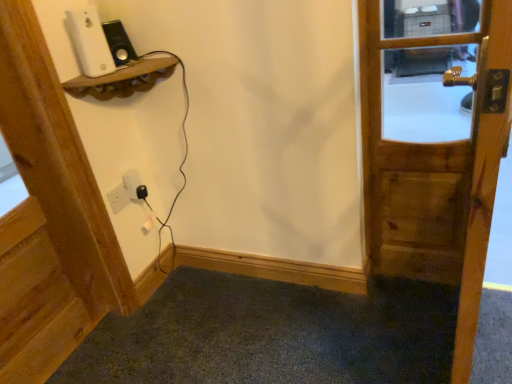
This screenshot has height=384, width=512. What are the coordinates of `white matte ipod at upper left` in the screenshot? It's located at (89, 42).

From the image's perspective, does wooden door at upper left, arranged as the 2th door when viewed from the right, appear higher than white matte ipod at upper left?

No, from the image's perspective, wooden door at upper left, arranged as the 2th door when viewed from the right, is not over white matte ipod at upper left.

Considering the relative positions of wooden door at upper left, which ranks as the first door in left-to-right order, and white matte ipod at upper left in the image provided, is wooden door at upper left, which ranks as the first door in left-to-right order, to the left of white matte ipod at upper left from the viewer's perspective?

Yes.

From a real-world perspective, which object stands above the other?

white matte ipod at upper left, from a real-world perspective.

Is wooden door at upper left, which ranks as the first door in left-to-right order, in contact with white matte ipod at upper left?

wooden door at upper left, which ranks as the first door in left-to-right order, and white matte ipod at upper left are not in contact.

Considering the sizes of objects black plastic plug at lower center and wooden door at upper left, which ranks as the first door in left-to-right order, in the image provided, who is smaller, black plastic plug at lower center or wooden door at upper left, which ranks as the first door in left-to-right order,?

With smaller size is black plastic plug at lower center.

Is black plastic plug at lower center at the left side of wooden door at upper left, arranged as the 2th door when viewed from the right?

In fact, black plastic plug at lower center is to the right of wooden door at upper left, arranged as the 2th door when viewed from the right.

Looking at this image, is black plastic plug at lower center beside wooden door at upper left, which ranks as the first door in left-to-right order?

There is a gap between black plastic plug at lower center and wooden door at upper left, which ranks as the first door in left-to-right order.

Is point (146, 191) closer to viewer compared to point (64, 137)?

No.

Which object is thinner, white matte ipod at upper left or black plastic plug at lower center?

With smaller width is black plastic plug at lower center.

From the image's perspective, is white matte ipod at upper left positioned above or below black plastic plug at lower center?

Based on their image positions, white matte ipod at upper left is located above black plastic plug at lower center.

In terms of size, does white matte ipod at upper left appear bigger or smaller than black plastic plug at lower center?

Considering their sizes, white matte ipod at upper left takes up more space than black plastic plug at lower center.

Locate an element on the screen. The image size is (512, 384). plug behind the white matte ipod at upper left is located at coordinates (141, 192).

From a real-world perspective, is white matte ipod at upper left over wooden door at upper left, arranged as the 2th door when viewed from the right?

Yes, from a real-world perspective, white matte ipod at upper left is above wooden door at upper left, arranged as the 2th door when viewed from the right.

Considering the sizes of white matte ipod at upper left and wooden door at upper left, which ranks as the first door in left-to-right order, in the image, is white matte ipod at upper left wider or thinner than wooden door at upper left, which ranks as the first door in left-to-right order,?

Clearly, white matte ipod at upper left has less width compared to wooden door at upper left, which ranks as the first door in left-to-right order.

Which is more to the right, white matte ipod at upper left or wooden door at upper left, arranged as the 2th door when viewed from the right?

Positioned to the right is white matte ipod at upper left.

From a real-world perspective, is wooden door at upper left, arranged as the 2th door when viewed from the right, positioned over wooden door handle at right, acting as the second door starting from the left, based on gravity?

Indeed, from a real-world perspective, wooden door at upper left, arranged as the 2th door when viewed from the right, stands above wooden door handle at right, acting as the second door starting from the left.

How distant is wooden door at upper left, arranged as the 2th door when viewed from the right, from wooden door handle at right, which is the 1th door in right-to-left order?

wooden door at upper left, arranged as the 2th door when viewed from the right, is 3.53 feet from wooden door handle at right, which is the 1th door in right-to-left order.

How many degrees apart are the facing directions of wooden door at upper left, which ranks as the first door in left-to-right order, and wooden door handle at right, which is the 1th door in right-to-left order?

7.52 degrees separate the facing orientations of wooden door at upper left, which ranks as the first door in left-to-right order, and wooden door handle at right, which is the 1th door in right-to-left order.

Is point (10, 341) positioned in front of point (361, 85)?

No, (10, 341) is further to viewer.

Would you say white matte ipod at upper left is part of black plastic plug at lower center's contents?

No, black plastic plug at lower center does not contain white matte ipod at upper left.

Locate an element on the screen. The width and height of the screenshot is (512, 384). plug below the white matte ipod at upper left (from a real-world perspective) is located at coordinates (141, 192).

From the image's perspective, which is above, black plastic plug at lower center or white matte ipod at upper left?

white matte ipod at upper left is shown above in the image.

From a real-world perspective, who is located lower, black plastic plug at lower center or white matte ipod at upper left?

black plastic plug at lower center, from a real-world perspective.

Which object is further away from the camera taking this photo, wooden door handle at right, which is the 1th door in right-to-left order, or white matte ipod at upper left?

white matte ipod at upper left is further away from the camera.

From a real-world perspective, is wooden door handle at right, which is the 1th door in right-to-left order, physically located above or below white matte ipod at upper left?

From a real-world perspective, wooden door handle at right, which is the 1th door in right-to-left order, is physically below white matte ipod at upper left.

What's the angular difference between wooden door handle at right, acting as the second door starting from the left, and white matte ipod at upper left's facing directions?

9.15 degrees.

You are a GUI agent. You are given a task and a screenshot of the screen. Output one action in this format:
    pyautogui.click(x=<x>, y=<y>)
    Task: Click on the 2nd door below the white matte ipod at upper left (from the image's perspective)
    The width and height of the screenshot is (512, 384).
    Given the screenshot: What is the action you would take?
    pyautogui.click(x=49, y=216)

Find the location of `plug below the wooden door at upper left, arranged as the 2th door when viewed from the right (from a real-world perspective)`. plug below the wooden door at upper left, arranged as the 2th door when viewed from the right (from a real-world perspective) is located at coordinates (141, 192).

Consider the image. Which object lies further to the anchor point wooden door at upper left, arranged as the 2th door when viewed from the right, wooden door handle at right, which is the 1th door in right-to-left order, or white matte ipod at upper left?

Among the two, wooden door handle at right, which is the 1th door in right-to-left order, is located further to wooden door at upper left, arranged as the 2th door when viewed from the right.

Looking at the image, which one is located further to white matte ipod at upper left, wooden door at upper left, which ranks as the first door in left-to-right order, or black plastic plug at lower center?

Among the two, black plastic plug at lower center is located further to white matte ipod at upper left.

Considering their positions, is wooden door handle at right, acting as the second door starting from the left, positioned closer to wooden door at upper left, arranged as the 2th door when viewed from the right, than black plastic plug at lower center?

Based on the image, black plastic plug at lower center appears to be nearer to wooden door at upper left, arranged as the 2th door when viewed from the right.

Looking at the image, which one is located closer to white matte ipod at upper left, wooden door handle at right, which is the 1th door in right-to-left order, or wooden door at upper left, arranged as the 2th door when viewed from the right?

wooden door at upper left, arranged as the 2th door when viewed from the right.

Looking at the image, which one is located further to black plastic plug at lower center, wooden door at upper left, arranged as the 2th door when viewed from the right, or white matte ipod at upper left?

white matte ipod at upper left lies further to black plastic plug at lower center than the other object.

When comparing their distances from black plastic plug at lower center, does wooden door handle at right, acting as the second door starting from the left, or wooden door at upper left, which ranks as the first door in left-to-right order, seem further?

wooden door handle at right, acting as the second door starting from the left.

Which object lies nearer to the anchor point black plastic plug at lower center, white matte ipod at upper left or wooden door handle at right, which is the 1th door in right-to-left order?

The object closer to black plastic plug at lower center is white matte ipod at upper left.

Estimate the real-world distances between objects in this image. Which object is closer to wooden door handle at right, which is the 1th door in right-to-left order, black plastic plug at lower center or wooden door at upper left, which ranks as the first door in left-to-right order?

The object closer to wooden door handle at right, which is the 1th door in right-to-left order, is black plastic plug at lower center.

I want to click on ipod between wooden door at upper left, arranged as the 2th door when viewed from the right, and wooden door handle at right, which is the 1th door in right-to-left order, so click(x=89, y=42).

Where is `ipod between wooden door at upper left, arranged as the 2th door when viewed from the right, and black plastic plug at lower center in the front-back direction`? The width and height of the screenshot is (512, 384). ipod between wooden door at upper left, arranged as the 2th door when viewed from the right, and black plastic plug at lower center in the front-back direction is located at coordinates (89, 42).

In order to click on ipod between wooden door handle at right, acting as the second door starting from the left, and black plastic plug at lower center in the front-back direction in this screenshot , I will do `click(89, 42)`.

You are a GUI agent. You are given a task and a screenshot of the screen. Output one action in this format:
    pyautogui.click(x=<x>, y=<y>)
    Task: Click on the plug between wooden door at upper left, arranged as the 2th door when viewed from the right, and wooden door handle at right, acting as the second door starting from the left, in the horizontal direction
    
    Given the screenshot: What is the action you would take?
    pyautogui.click(x=141, y=192)